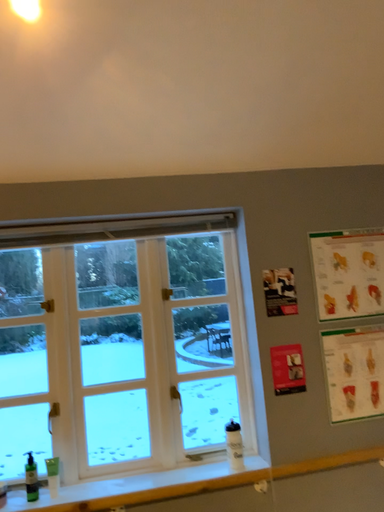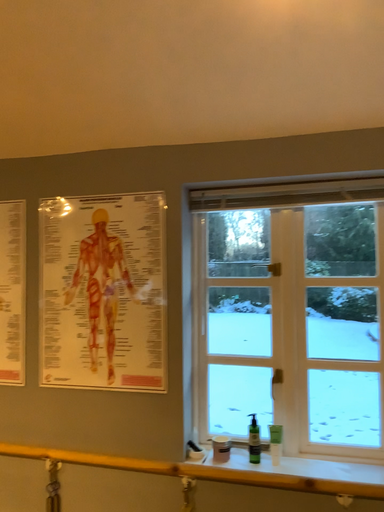
Question: Which way did the camera rotate in the video?

Choices:
 (A) rotated left
 (B) rotated right

Answer: (A)